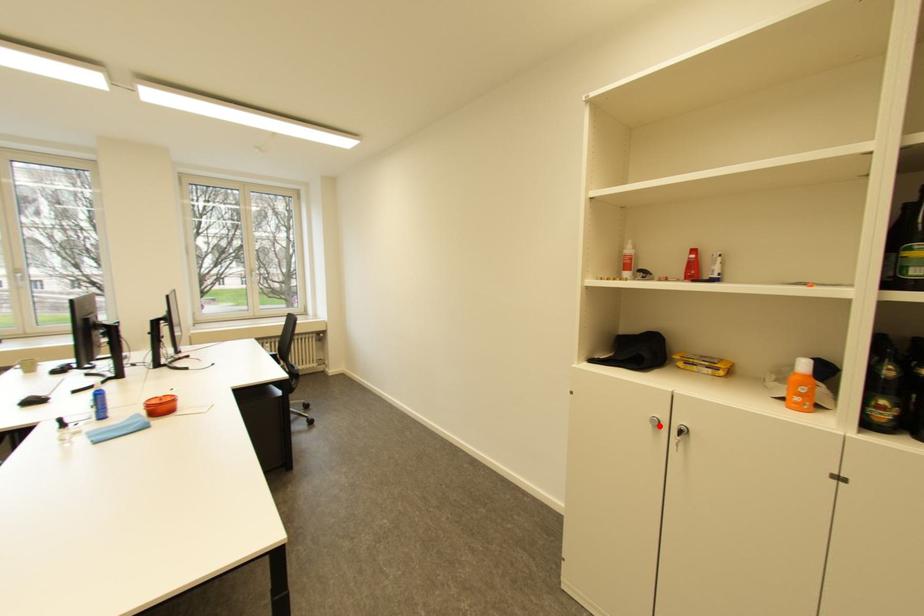
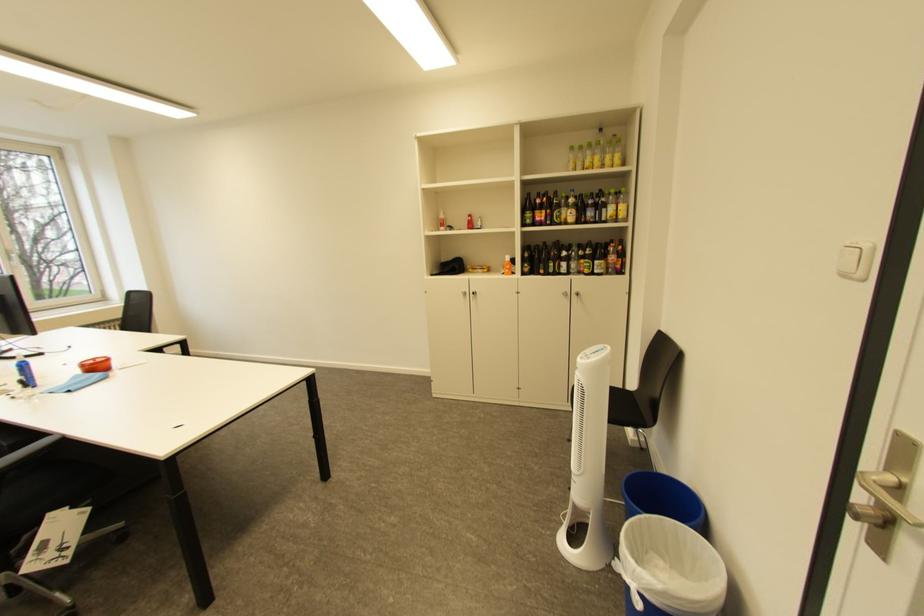
In the second image, find the point that corresponds to the highlighted location in the first image.

(472, 296)